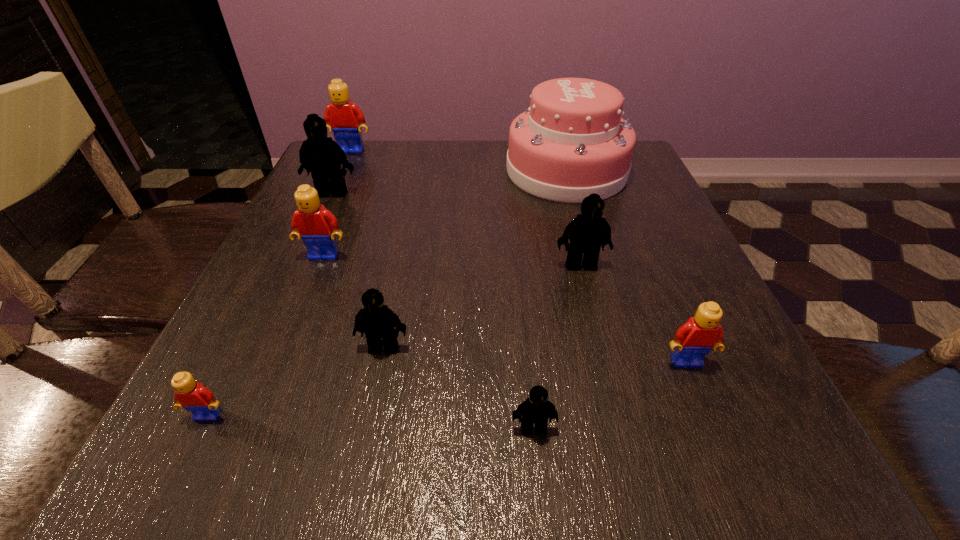
The image size is (960, 540). I want to click on empty location between the farthest yellow Lego and the third farthest yellow Lego, so click(x=518, y=256).

You are a GUI agent. You are given a task and a screenshot of the screen. Output one action in this format:
    pyautogui.click(x=<x>, y=<y>)
    Task: Click on the vacant space in between the nearest yellow Lego and the rightmost Lego
    Image resolution: width=960 pixels, height=540 pixels.
    Given the screenshot: What is the action you would take?
    pyautogui.click(x=447, y=388)

Where is `unoccupied position between the cake and the leftmost black Lego`? unoccupied position between the cake and the leftmost black Lego is located at coordinates (449, 182).

Identify the location of the third closest object relative to the smallest yellow Lego. (536, 409).

You are a GUI agent. You are given a task and a screenshot of the screen. Output one action in this format:
    pyautogui.click(x=<x>, y=<y>)
    Task: Click on the third closest object relative to the third farthest yellow Lego
    This screenshot has height=540, width=960.
    Given the screenshot: What is the action you would take?
    pyautogui.click(x=376, y=320)

Identify which Lego is located as the second nearest to the seventh nearest Lego. Please provide its 2D coordinates. Your answer should be formatted as a tuple, i.e. [(x, y)], where the tuple contains the x and y coordinates of a point satisfying the conditions above.

[(312, 222)]

Locate which Lego ranks second in proximity to the second Lego from right to left. Please provide its 2D coordinates. Your answer should be formatted as a tuple, i.e. [(x, y)], where the tuple contains the x and y coordinates of a point satisfying the conditions above.

[(376, 320)]

Where is `the closest black Lego to the farthest black Lego`? This screenshot has height=540, width=960. the closest black Lego to the farthest black Lego is located at coordinates (376, 320).

Select which black Lego is the fourth closest to the second smallest yellow Lego. Please provide its 2D coordinates. Your answer should be formatted as a tuple, i.e. [(x, y)], where the tuple contains the x and y coordinates of a point satisfying the conditions above.

[(321, 155)]

The height and width of the screenshot is (540, 960). I want to click on the second closest yellow Lego to the smallest black Lego, so click(193, 396).